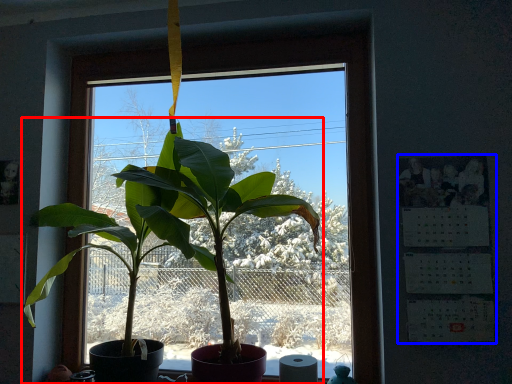
Question: Which of the following is the farthest to the observer, houseplant (highlighted by a red box) or bulletin board (highlighted by a blue box)?

Choices:
 (A) houseplant
 (B) bulletin board

Answer: (B)